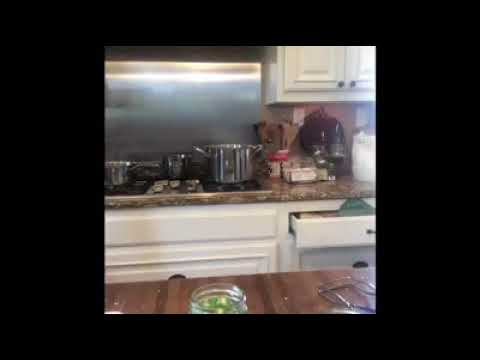
Locate an element on the screen. counter top is located at coordinates (251, 197).